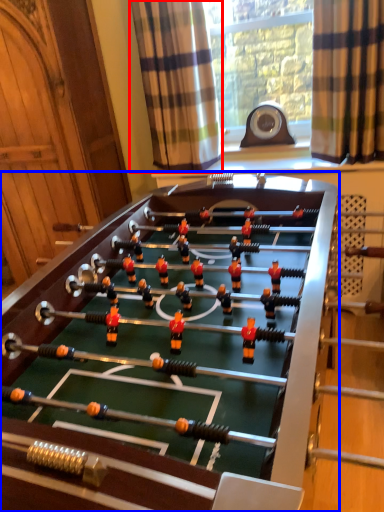
Question: Which of the following is the closest to the observer, curtain (highlighted by a red box) or table (highlighted by a blue box)?

Choices:
 (A) curtain
 (B) table

Answer: (B)